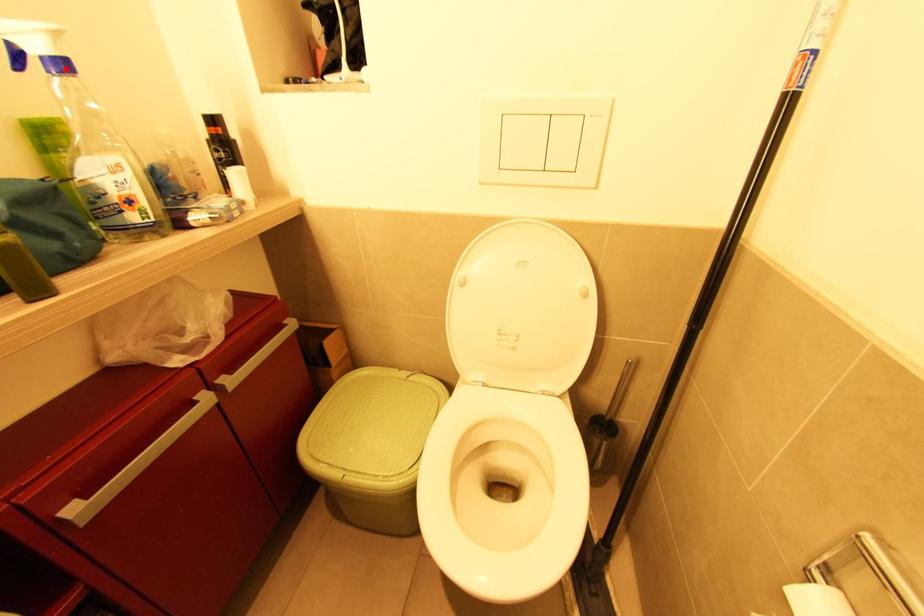
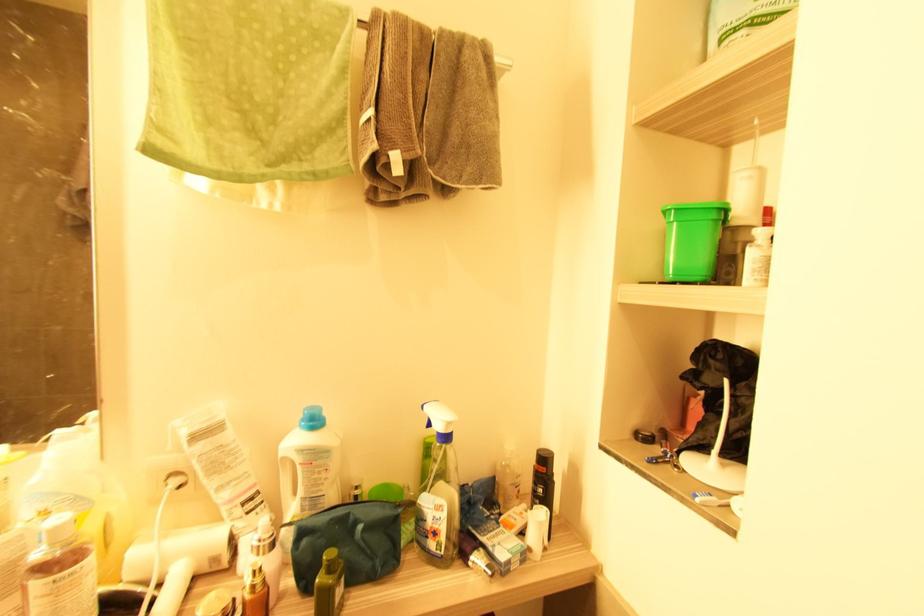
The point at the highlighted location is marked in the first image. Where is the corresponding point in the second image?

(447, 438)